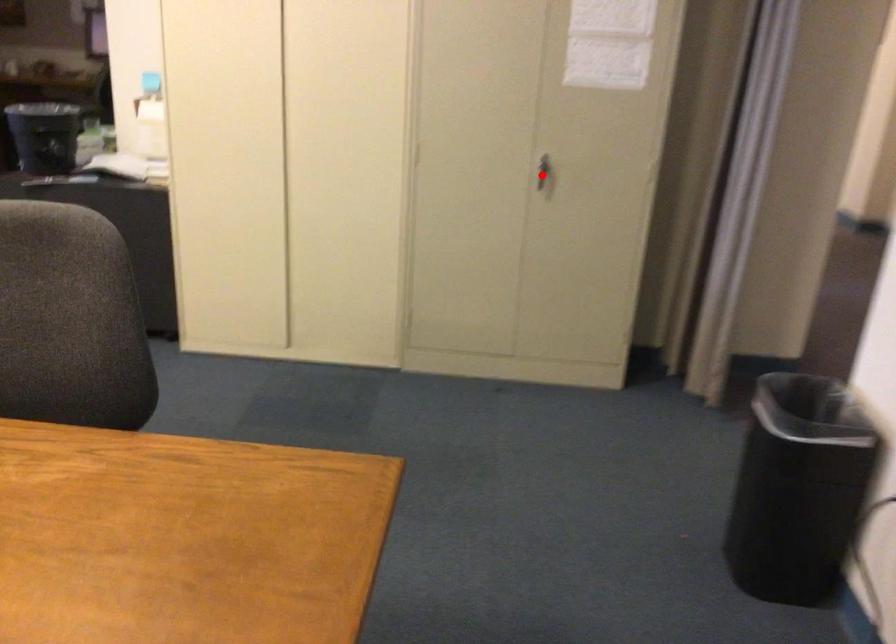
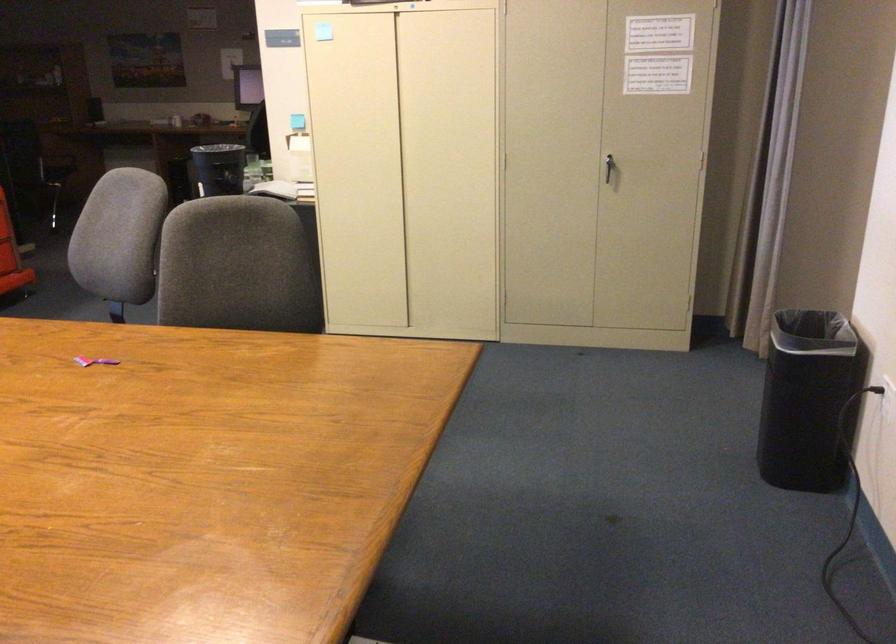
Locate, in the second image, the point that corresponds to the highlighted location in the first image.

(609, 169)